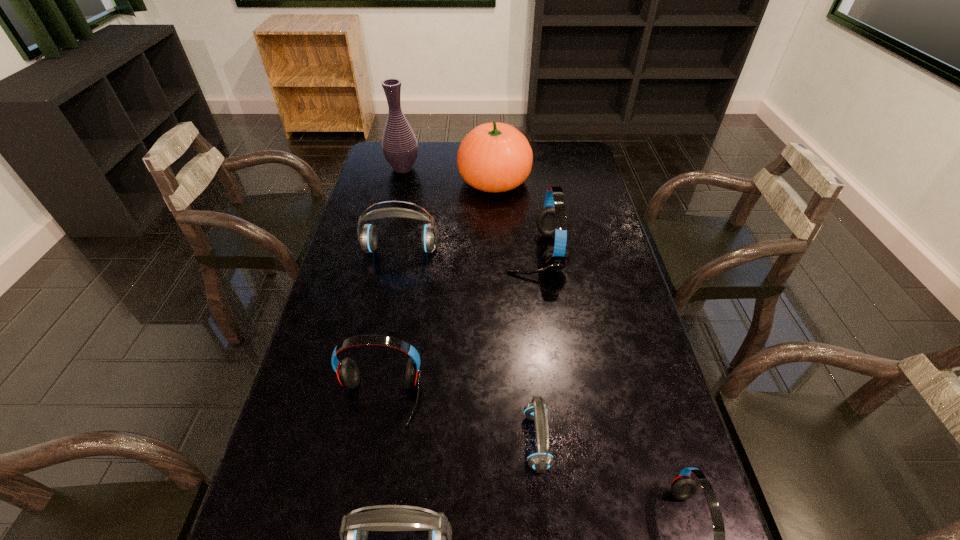
You are a GUI agent. You are given a task and a screenshot of the screen. Output one action in this format:
    pyautogui.click(x=<x>, y=<y>)
    Task: Click on the free point between the leftmost red headset and the tallest object
    This screenshot has height=540, width=960.
    Given the screenshot: What is the action you would take?
    pyautogui.click(x=392, y=283)

This screenshot has height=540, width=960. Find the location of `blank region between the rightmost blue headset and the biggest blue headset`. blank region between the rightmost blue headset and the biggest blue headset is located at coordinates (468, 345).

Select which object is the seventh closest to the smallest red headset. Please provide its 2D coordinates. Your answer should be formatted as a tuple, i.e. [(x, y)], where the tuple contains the x and y coordinates of a point satisfying the conditions above.

[(399, 144)]

Where is `the fifth closest object to the pumpkin`? This screenshot has height=540, width=960. the fifth closest object to the pumpkin is located at coordinates (541, 460).

Select which headset appears as the fifth closest to the second smallest blue headset. Please provide its 2D coordinates. Your answer should be formatted as a tuple, i.e. [(x, y)], where the tuple contains the x and y coordinates of a point satisfying the conditions above.

[(367, 236)]

Locate which headset is the fifth closest to the second smallest blue headset. Please provide its 2D coordinates. Your answer should be formatted as a tuple, i.e. [(x, y)], where the tuple contains the x and y coordinates of a point satisfying the conditions above.

[(367, 236)]

Identify which red headset is located as the second nearest to the pumpkin. Please provide its 2D coordinates. Your answer should be formatted as a tuple, i.e. [(x, y)], where the tuple contains the x and y coordinates of a point satisfying the conditions above.

[(347, 372)]

This screenshot has width=960, height=540. Find the location of `red headset that stands as the closest to the farthest blue headset`. red headset that stands as the closest to the farthest blue headset is located at coordinates coord(552,220).

I want to click on blue headset identified as the second closest to the pumpkin, so click(541, 460).

Choose which blue headset is the third nearest neighbor to the pumpkin. Please provide its 2D coordinates. Your answer should be formatted as a tuple, i.e. [(x, y)], where the tuple contains the x and y coordinates of a point satisfying the conditions above.

[(354, 533)]